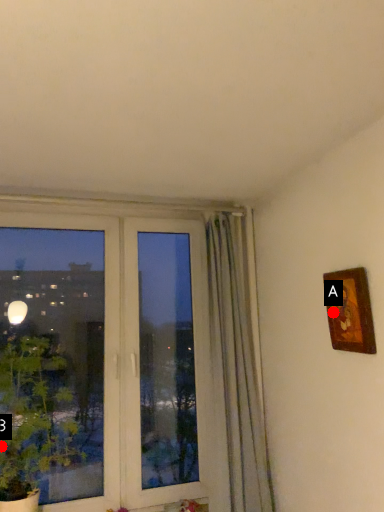
Question: Two points are circled on the image, labeled by A and B beside each circle. Which of the following is the farthest from the observer?

Choices:
 (A) A is further
 (B) B is further

Answer: (B)